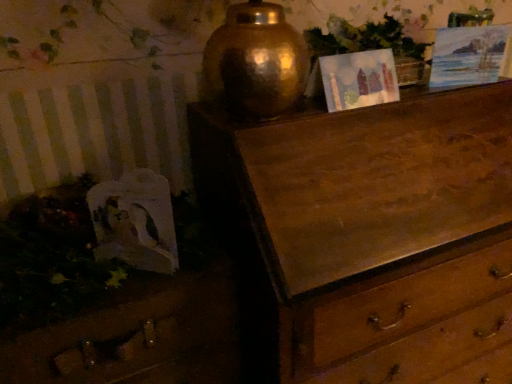
What is the approximate width of watercolor paper picture frame at upper right, acting as the 2th picture frame starting from the left?

3.53 inches.

What do you see at coordinates (359, 79) in the screenshot? I see `matte paper picture frame at upper center, which is counted as the first picture frame, starting from the left` at bounding box center [359, 79].

This screenshot has height=384, width=512. Identify the location of wooden drawer at lower left. (137, 341).

In order to click on watercolor paper picture frame at upper right, acting as the 2th picture frame starting from the left in this screenshot , I will do `click(468, 55)`.

How many degrees apart are the facing directions of wooden drawer at lower left and watercolor paper picture frame at upper right, placed as the first picture frame when sorted from right to left?

The angular difference between wooden drawer at lower left and watercolor paper picture frame at upper right, placed as the first picture frame when sorted from right to left, is 16.4 degrees.

Considering the relative sizes of wooden drawer at lower left and watercolor paper picture frame at upper right, placed as the first picture frame when sorted from right to left, in the image provided, is wooden drawer at lower left wider than watercolor paper picture frame at upper right, placed as the first picture frame when sorted from right to left,?

Yes.

Does wooden drawer at lower left have a smaller size compared to watercolor paper picture frame at upper right, acting as the 2th picture frame starting from the left?

No.

Does matte paper picture frame at upper center, the 2th picture frame in the right-to-left sequence, come behind watercolor paper picture frame at upper right, acting as the 2th picture frame starting from the left?

That is False.

Considering the sizes of objects matte paper picture frame at upper center, the 2th picture frame in the right-to-left sequence, and watercolor paper picture frame at upper right, acting as the 2th picture frame starting from the left, in the image provided, who is smaller, matte paper picture frame at upper center, the 2th picture frame in the right-to-left sequence, or watercolor paper picture frame at upper right, acting as the 2th picture frame starting from the left,?

matte paper picture frame at upper center, the 2th picture frame in the right-to-left sequence.

From the image's perspective, which object appears higher, matte paper picture frame at upper center, the 2th picture frame in the right-to-left sequence, or watercolor paper picture frame at upper right, acting as the 2th picture frame starting from the left?

watercolor paper picture frame at upper right, acting as the 2th picture frame starting from the left, from the image's perspective.

Is point (376, 74) closer to camera compared to point (439, 79)?

Yes, it is in front of point (439, 79).

Which is less distant, [369,97] or [406,84]?

Point [369,97]

Is matte paper picture frame at upper center, the 2th picture frame in the right-to-left sequence, not inside green leafy plant at upper center?

Indeed, matte paper picture frame at upper center, the 2th picture frame in the right-to-left sequence, is completely outside green leafy plant at upper center.

Considering the sizes of objects matte paper picture frame at upper center, the 2th picture frame in the right-to-left sequence, and green leafy plant at upper center in the image provided, who is wider, matte paper picture frame at upper center, the 2th picture frame in the right-to-left sequence, or green leafy plant at upper center?

green leafy plant at upper center.

In the image, is matte paper picture frame at upper center, which is counted as the first picture frame, starting from the left, positioned in front of or behind green leafy plant at upper center?

matte paper picture frame at upper center, which is counted as the first picture frame, starting from the left, is in front of green leafy plant at upper center.

Considering the positions of points (389, 47) and (373, 68), is point (389, 47) farther from camera compared to point (373, 68)?

Yes, it is behind point (373, 68).

Could you tell me if green leafy plant at upper center is facing matte paper picture frame at upper center, which is counted as the first picture frame, starting from the left?

Yes, green leafy plant at upper center is turned towards matte paper picture frame at upper center, which is counted as the first picture frame, starting from the left.

Between green leafy plant at upper center and matte paper picture frame at upper center, which is counted as the first picture frame, starting from the left, which one appears on the left side from the viewer's perspective?

From the viewer's perspective, matte paper picture frame at upper center, which is counted as the first picture frame, starting from the left, appears more on the left side.

Looking at this image, from the image's perspective, which object appears higher, green leafy plant at upper center or matte paper picture frame at upper center, which is counted as the first picture frame, starting from the left?

green leafy plant at upper center is shown above in the image.

Who is smaller, watercolor paper picture frame at upper right, acting as the 2th picture frame starting from the left, or matte paper picture frame at upper center, which is counted as the first picture frame, starting from the left?

matte paper picture frame at upper center, which is counted as the first picture frame, starting from the left.

Which point is more forward, (452, 79) or (368, 92)?

The point (368, 92) is in front.

Is watercolor paper picture frame at upper right, acting as the 2th picture frame starting from the left, wider or thinner than matte paper picture frame at upper center, the 2th picture frame in the right-to-left sequence?

Clearly, watercolor paper picture frame at upper right, acting as the 2th picture frame starting from the left, has less width compared to matte paper picture frame at upper center, the 2th picture frame in the right-to-left sequence.

Locate an element on the screen. Image resolution: width=512 pixels, height=384 pixels. picture frame in front of the watercolor paper picture frame at upper right, acting as the 2th picture frame starting from the left is located at coordinates (359, 79).

Which object is wider, wooden drawer at lower left or green leafy plant at upper center?

wooden drawer at lower left.

Who is more distant, wooden drawer at lower left or green leafy plant at upper center?

Positioned behind is green leafy plant at upper center.

Can you confirm if wooden drawer at lower left is positioned to the left of green leafy plant at upper center?

Yes.

Considering the sizes of objects wooden drawer at lower left and green leafy plant at upper center in the image provided, who is taller, wooden drawer at lower left or green leafy plant at upper center?

wooden drawer at lower left.

Does green leafy plant at upper center appear on the left side of wooden drawer at lower left?

Incorrect, green leafy plant at upper center is not on the left side of wooden drawer at lower left.

From the image's perspective, between green leafy plant at upper center and wooden drawer at lower left, which one is located above?

green leafy plant at upper center is shown above in the image.

Is green leafy plant at upper center far from wooden drawer at lower left?

Actually, green leafy plant at upper center and wooden drawer at lower left are a little close together.

This screenshot has height=384, width=512. There is a wooden drawer at lower left. Find the location of `the 2nd picture frame above it (from the image's perspective)`. the 2nd picture frame above it (from the image's perspective) is located at coordinates (468, 55).

I want to click on picture frame above the matte paper picture frame at upper center, the 2th picture frame in the right-to-left sequence (from a real-world perspective), so click(468, 55).

In the scene shown: Based on their spatial positions, is wooden drawer at lower left or green leafy plant at upper center closer to matte paper picture frame at upper center, which is counted as the first picture frame, starting from the left?

green leafy plant at upper center is closer to matte paper picture frame at upper center, which is counted as the first picture frame, starting from the left.

Estimate the real-world distances between objects in this image. Which object is closer to green leafy plant at upper center, watercolor paper picture frame at upper right, acting as the 2th picture frame starting from the left, or wooden drawer at lower left?

watercolor paper picture frame at upper right, acting as the 2th picture frame starting from the left, lies closer to green leafy plant at upper center than the other object.

When comparing their distances from wooden drawer at lower left, does watercolor paper picture frame at upper right, placed as the first picture frame when sorted from right to left, or green leafy plant at upper center seem closer?

green leafy plant at upper center is positioned closer to the anchor wooden drawer at lower left.

Looking at the image, which one is located further to wooden drawer at lower left, green leafy plant at upper center or watercolor paper picture frame at upper right, acting as the 2th picture frame starting from the left?

watercolor paper picture frame at upper right, acting as the 2th picture frame starting from the left.

Estimate the real-world distances between objects in this image. Which object is closer to matte paper picture frame at upper center, which is counted as the first picture frame, starting from the left, green leafy plant at upper center or watercolor paper picture frame at upper right, placed as the first picture frame when sorted from right to left?

green leafy plant at upper center is closer to matte paper picture frame at upper center, which is counted as the first picture frame, starting from the left.

When comparing their distances from matte paper picture frame at upper center, the 2th picture frame in the right-to-left sequence, does wooden drawer at lower left or watercolor paper picture frame at upper right, placed as the first picture frame when sorted from right to left, seem further?

Among the two, wooden drawer at lower left is located further to matte paper picture frame at upper center, the 2th picture frame in the right-to-left sequence.

Which object lies further to the anchor point watercolor paper picture frame at upper right, placed as the first picture frame when sorted from right to left, matte paper picture frame at upper center, which is counted as the first picture frame, starting from the left, or green leafy plant at upper center?

matte paper picture frame at upper center, which is counted as the first picture frame, starting from the left, is further to watercolor paper picture frame at upper right, placed as the first picture frame when sorted from right to left.

From the image, which object appears to be nearer to green leafy plant at upper center, wooden drawer at lower left or watercolor paper picture frame at upper right, acting as the 2th picture frame starting from the left?

Among the two, watercolor paper picture frame at upper right, acting as the 2th picture frame starting from the left, is located nearer to green leafy plant at upper center.

Locate an element on the screen. This screenshot has width=512, height=384. vegetation between matte paper picture frame at upper center, the 2th picture frame in the right-to-left sequence, and watercolor paper picture frame at upper right, placed as the first picture frame when sorted from right to left, from left to right is located at coordinates (371, 44).

The height and width of the screenshot is (384, 512). What are the coordinates of `picture frame between watercolor paper picture frame at upper right, acting as the 2th picture frame starting from the left, and wooden drawer at lower left vertically` in the screenshot? It's located at [359, 79].